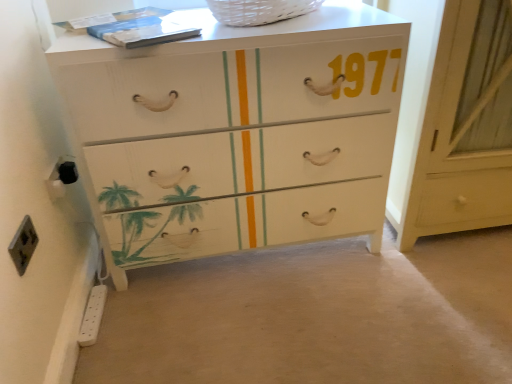
Measure the distance between white painted wood chest of drawers at center and camera.

The depth of white painted wood chest of drawers at center is 3.60 feet.

In order to click on white plastic power strip at lower left, placed as the 1th electric outlet when sorted from bottom to top in this screenshot , I will do click(x=92, y=316).

Find the location of a particular element. black plastic outlet at lower left, the third electric outlet in the back-to-front sequence is located at coordinates (23, 245).

What is the approximate width of white wood cabinet at right?

The width of white wood cabinet at right is 58.66 centimeters.

The image size is (512, 384). Identify the location of white painted wood chest of drawers at center. (236, 133).

How many degrees apart are the facing directions of white plastic power strip at lower left, placed as the 1th electric outlet when sorted from bottom to top, and black plastic socket at lower left, the 2th electric outlet in the back-to-front sequence?

white plastic power strip at lower left, placed as the 1th electric outlet when sorted from bottom to top, and black plastic socket at lower left, the 2th electric outlet in the back-to-front sequence, are facing 1.27 degrees away from each other.

Which object is closer to the camera, white plastic power strip at lower left, placed as the 1th electric outlet when sorted from bottom to top, or black plastic socket at lower left, the first electric outlet from the top?

Positioned in front is black plastic socket at lower left, the first electric outlet from the top.

Does white plastic power strip at lower left, the 3th electric outlet viewed from the front, have a smaller size compared to black plastic socket at lower left, marked as the 3th electric outlet in a bottom-to-top arrangement?

No, white plastic power strip at lower left, the 3th electric outlet viewed from the front, is not smaller than black plastic socket at lower left, marked as the 3th electric outlet in a bottom-to-top arrangement.

Which is less distant, (100, 301) or (63, 193)?

Point (100, 301) is farther from the camera than point (63, 193).

From a real-world perspective, who is located higher, white wood cabinet at right or black plastic socket at lower left, the 2th electric outlet when ordered from front to back?

From a 3D spatial view, white wood cabinet at right is above.

Are white wood cabinet at right and black plastic socket at lower left, marked as the 3th electric outlet in a bottom-to-top arrangement, far apart?

Yes, white wood cabinet at right and black plastic socket at lower left, marked as the 3th electric outlet in a bottom-to-top arrangement, are quite far apart.

From the image's perspective, is white wood cabinet at right located above or below black plastic socket at lower left, the first electric outlet from the top?

From the image's perspective, white wood cabinet at right appears above black plastic socket at lower left, the first electric outlet from the top.

Is black plastic socket at lower left, the 2th electric outlet in the back-to-front sequence, positioned with its back to white painted wood chest of drawers at center?

That's not correct — black plastic socket at lower left, the 2th electric outlet in the back-to-front sequence, is not looking away from white painted wood chest of drawers at center.

How many degrees apart are the facing directions of black plastic socket at lower left, the 2th electric outlet when ordered from front to back, and white painted wood chest of drawers at center?

89.8 degrees.

Considering the positions of point (59, 177) and point (189, 11), is point (59, 177) closer or farther from the camera than point (189, 11)?

Point (59, 177) is closer to the camera than point (189, 11).

From a real-world perspective, which object rests below the other?

white painted wood chest of drawers at center, from a real-world perspective.

Does point (260, 83) come behind point (454, 102)?

No, it is in front of (454, 102).

Which of these two, white painted wood chest of drawers at center or white wood cabinet at right, is bigger?

white painted wood chest of drawers at center.

Do you think white painted wood chest of drawers at center is within white wood cabinet at right, or outside of it?

white painted wood chest of drawers at center is not inside white wood cabinet at right, it's outside.

What are the coordinates of `chest of drawers on the left of white wood cabinet at right` in the screenshot? It's located at (236, 133).

Could you tell me if black plastic outlet at lower left, the 2th electric outlet viewed from the top, is facing white wicker basket at upper center?

No, black plastic outlet at lower left, the 2th electric outlet viewed from the top, is not aimed at white wicker basket at upper center.

From the image's perspective, count 2nd electric outlets downward from the white wicker basket at upper center and point to it. Please provide its 2D coordinates.

[(23, 245)]

Considering the sizes of black plastic outlet at lower left, which is the 1th electric outlet in front-to-back order, and white wicker basket at upper center in the image, is black plastic outlet at lower left, which is the 1th electric outlet in front-to-back order, taller or shorter than white wicker basket at upper center?

Considering their sizes, black plastic outlet at lower left, which is the 1th electric outlet in front-to-back order, has more height than white wicker basket at upper center.

Is black plastic socket at lower left, the 2th electric outlet when ordered from front to back, not inside white wood cabinet at right?

That's correct, black plastic socket at lower left, the 2th electric outlet when ordered from front to back, is outside of white wood cabinet at right.

Are black plastic socket at lower left, marked as the 3th electric outlet in a bottom-to-top arrangement, and white wood cabinet at right far apart?

Absolutely, black plastic socket at lower left, marked as the 3th electric outlet in a bottom-to-top arrangement, is distant from white wood cabinet at right.

From the image's perspective, is black plastic socket at lower left, the 2th electric outlet in the back-to-front sequence, located above white wood cabinet at right?

No, from the image's perspective, black plastic socket at lower left, the 2th electric outlet in the back-to-front sequence, is not above white wood cabinet at right.

Could you tell me if black plastic socket at lower left, the 2th electric outlet when ordered from front to back, is turned towards white wood cabinet at right?

Yes, black plastic socket at lower left, the 2th electric outlet when ordered from front to back, is aimed at white wood cabinet at right.

Considering the sizes of black plastic socket at lower left, the 2th electric outlet when ordered from front to back, and white wicker basket at upper center in the image, is black plastic socket at lower left, the 2th electric outlet when ordered from front to back, bigger or smaller than white wicker basket at upper center?

black plastic socket at lower left, the 2th electric outlet when ordered from front to back, is smaller than white wicker basket at upper center.

Which of these two, black plastic socket at lower left, the 2th electric outlet when ordered from front to back, or white wicker basket at upper center, is thinner?

Thinner between the two is black plastic socket at lower left, the 2th electric outlet when ordered from front to back.

From a real-world perspective, is black plastic socket at lower left, marked as the 3th electric outlet in a bottom-to-top arrangement, positioned above or below white wicker basket at upper center?

Clearly, from a real-world perspective, black plastic socket at lower left, marked as the 3th electric outlet in a bottom-to-top arrangement, is below white wicker basket at upper center.

Between point (63, 185) and point (250, 21), which one is positioned behind?

The point (63, 185) is behind.

From a real-world perspective, which electric outlet is the 2nd one above the white plastic power strip at lower left, placed as the 1th electric outlet when sorted from bottom to top? Please provide its 2D coordinates.

[(61, 178)]

This screenshot has width=512, height=384. I want to click on cabinetry on the right of black plastic socket at lower left, the 2th electric outlet in the back-to-front sequence, so click(x=465, y=127).

Estimate the real-world distances between objects in this image. Which object is further from black plastic outlet at lower left, positioned as the second electric outlet in bottom-to-top order, white plastic power strip at lower left, placed as the 1th electric outlet when sorted from bottom to top, or white wood cabinet at right?

white wood cabinet at right.

From the image, which object appears to be farther from white wicker basket at upper center, black plastic outlet at lower left, the 2th electric outlet viewed from the top, or white wood cabinet at right?

black plastic outlet at lower left, the 2th electric outlet viewed from the top, is positioned further to the anchor white wicker basket at upper center.

Based on their spatial positions, is black plastic socket at lower left, marked as the 3th electric outlet in a bottom-to-top arrangement, or white wicker basket at upper center closer to white plastic power strip at lower left, placed as the 1th electric outlet when sorted from bottom to top?

black plastic socket at lower left, marked as the 3th electric outlet in a bottom-to-top arrangement.

Based on their spatial positions, is black plastic socket at lower left, marked as the 3th electric outlet in a bottom-to-top arrangement, or white plastic power strip at lower left, the 3th electric outlet viewed from the front, closer to white painted wood chest of drawers at center?

Based on the image, black plastic socket at lower left, marked as the 3th electric outlet in a bottom-to-top arrangement, appears to be nearer to white painted wood chest of drawers at center.

Considering their positions, is white wood cabinet at right positioned closer to black plastic outlet at lower left, which is the 1th electric outlet in front-to-back order, than white wicker basket at upper center?

white wicker basket at upper center lies closer to black plastic outlet at lower left, which is the 1th electric outlet in front-to-back order, than the other object.

Estimate the real-world distances between objects in this image. Which object is further from white wicker basket at upper center, white wood cabinet at right or black plastic outlet at lower left, the third electric outlet in the back-to-front sequence?

The object further to white wicker basket at upper center is black plastic outlet at lower left, the third electric outlet in the back-to-front sequence.

When comparing their distances from white wood cabinet at right, does white wicker basket at upper center or black plastic outlet at lower left, the third electric outlet in the back-to-front sequence, seem closer?

white wicker basket at upper center is positioned closer to the anchor white wood cabinet at right.

Estimate the real-world distances between objects in this image. Which object is further from white wood cabinet at right, white painted wood chest of drawers at center or white plastic power strip at lower left, placed as the 1th electric outlet when sorted from bottom to top?

white plastic power strip at lower left, placed as the 1th electric outlet when sorted from bottom to top, is further to white wood cabinet at right.

Identify the location of the chest of drawers between white wicker basket at upper center and white plastic power strip at lower left, the 3th electric outlet positioned from the top, vertically. Image resolution: width=512 pixels, height=384 pixels. (236, 133).

Where is `chest of drawers between white wicker basket at upper center and black plastic outlet at lower left, positioned as the second electric outlet in bottom-to-top order, in the up-down direction`? The width and height of the screenshot is (512, 384). chest of drawers between white wicker basket at upper center and black plastic outlet at lower left, positioned as the second electric outlet in bottom-to-top order, in the up-down direction is located at coordinates (236, 133).

Find the location of a particular element. The width and height of the screenshot is (512, 384). the chest of drawers situated between black plastic socket at lower left, the first electric outlet from the top, and white wood cabinet at right from left to right is located at coordinates (236, 133).

Locate an element on the screen. Image resolution: width=512 pixels, height=384 pixels. basket located between white plastic power strip at lower left, the 3th electric outlet positioned from the top, and white wood cabinet at right in the left-right direction is located at coordinates (259, 11).